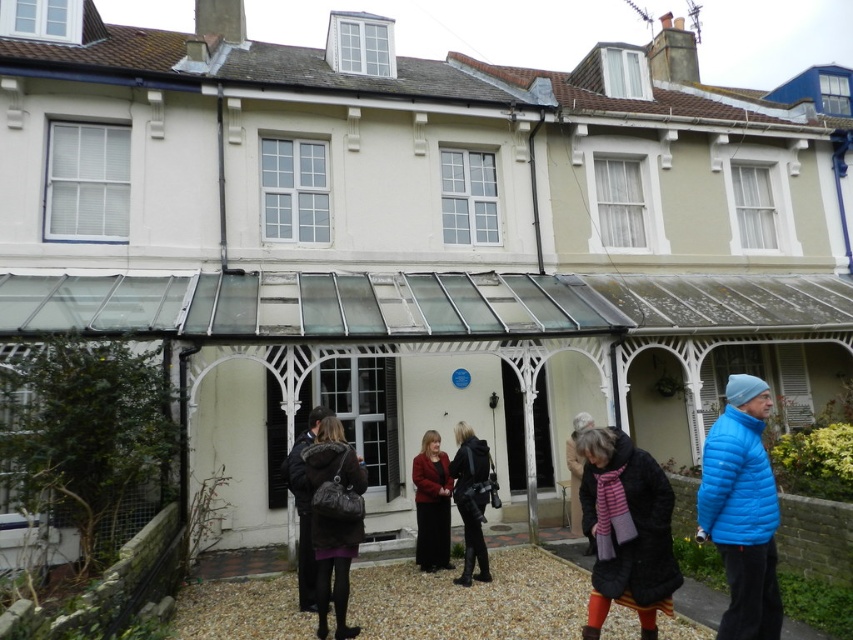
Question: Based on their relative distances, which object is nearer to the matte red coat at center?

Choices:
 (A) dark gray wool coat at lower left
 (B) blue down jacket at right
 (C) striped scarf at center
 (D) black fuzzy coat at lower right

Answer: (A)

Question: Among these objects, which one is nearest to the camera?

Choices:
 (A) dark gray wool coat at lower left
 (B) matte red coat at center
 (C) matte black coat at lower left

Answer: (C)

Question: Which object is positioned closest to the dark gray wool coat at lower left?

Choices:
 (A) blue down jacket at right
 (B) black fuzzy coat at lower right
 (C) matte black coat at lower left
 (D) matte red coat at center

Answer: (C)

Question: Does blue down jacket at right appear over striped scarf at center?

Choices:
 (A) yes
 (B) no

Answer: (A)

Question: Is blue down jacket at right bigger than black fuzzy coat at lower right?

Choices:
 (A) yes
 (B) no

Answer: (B)

Question: Is dark gray wool coat at lower left above striped scarf at center?

Choices:
 (A) yes
 (B) no

Answer: (A)